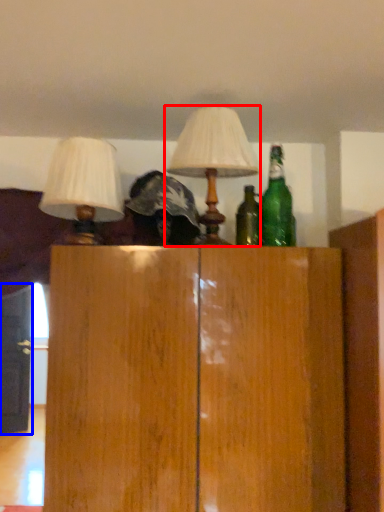
Question: Among these objects, which one is farthest to the camera, lamp (highlighted by a red box) or door (highlighted by a blue box)?

Choices:
 (A) lamp
 (B) door

Answer: (B)